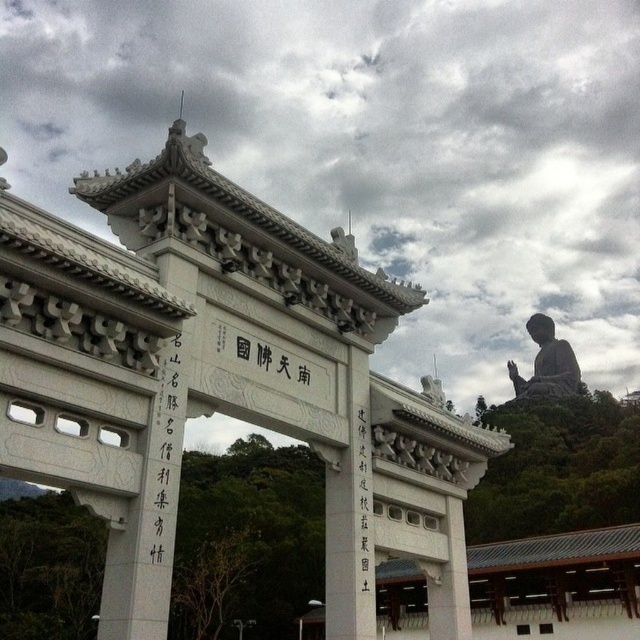
Question: Which point is farther to the camera?

Choices:
 (A) white stone gate at center
 (B) black stone statue at upper right

Answer: (B)

Question: Can you confirm if white stone gate at center is positioned to the left of black stone statue at upper right?

Choices:
 (A) yes
 (B) no

Answer: (A)

Question: Is white stone gate at center to the left of black stone statue at upper right from the viewer's perspective?

Choices:
 (A) yes
 (B) no

Answer: (A)

Question: Which of the following is the closest to the observer?

Choices:
 (A) white stone gate at center
 (B) black stone statue at upper right

Answer: (A)

Question: Is white stone gate at center above black stone statue at upper right?

Choices:
 (A) no
 (B) yes

Answer: (A)